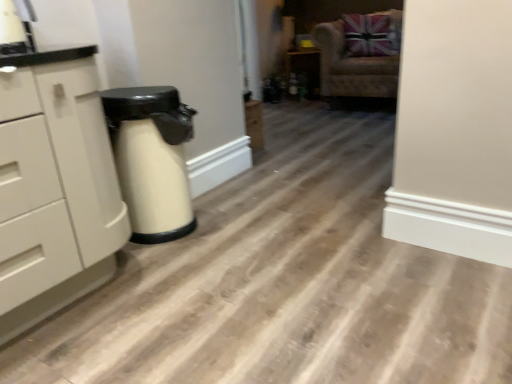
Question: Does velvet beige armchair at upper right appear on the left side of white matte chest of drawers at left?

Choices:
 (A) no
 (B) yes

Answer: (A)

Question: Does velvet beige armchair at upper right have a lesser height compared to white matte chest of drawers at left?

Choices:
 (A) yes
 (B) no

Answer: (A)

Question: Is velvet beige armchair at upper right aimed at white matte chest of drawers at left?

Choices:
 (A) yes
 (B) no

Answer: (A)

Question: Is velvet beige armchair at upper right bigger than white matte chest of drawers at left?

Choices:
 (A) yes
 (B) no

Answer: (A)

Question: Is velvet beige armchair at upper right at the right side of white matte chest of drawers at left?

Choices:
 (A) yes
 (B) no

Answer: (A)

Question: Considering the relative sizes of velvet beige armchair at upper right and white matte chest of drawers at left in the image provided, is velvet beige armchair at upper right thinner than white matte chest of drawers at left?

Choices:
 (A) no
 (B) yes

Answer: (A)

Question: Does matte black cabinet at center have a smaller size compared to velvet beige armchair at upper right?

Choices:
 (A) yes
 (B) no

Answer: (A)

Question: Would you say velvet beige armchair at upper right is part of matte black cabinet at center's contents?

Choices:
 (A) no
 (B) yes

Answer: (A)

Question: Is matte black cabinet at center completely or partially outside of velvet beige armchair at upper right?

Choices:
 (A) no
 (B) yes

Answer: (B)

Question: From the image's perspective, is matte black cabinet at center under velvet beige armchair at upper right?

Choices:
 (A) no
 (B) yes

Answer: (A)

Question: Is matte black cabinet at center closer to camera compared to velvet beige armchair at upper right?

Choices:
 (A) no
 (B) yes

Answer: (A)

Question: Is matte black cabinet at center turned away from velvet beige armchair at upper right?

Choices:
 (A) no
 (B) yes

Answer: (A)

Question: Is velvet beige armchair at upper right bigger than matte black cabinet at center?

Choices:
 (A) yes
 (B) no

Answer: (A)